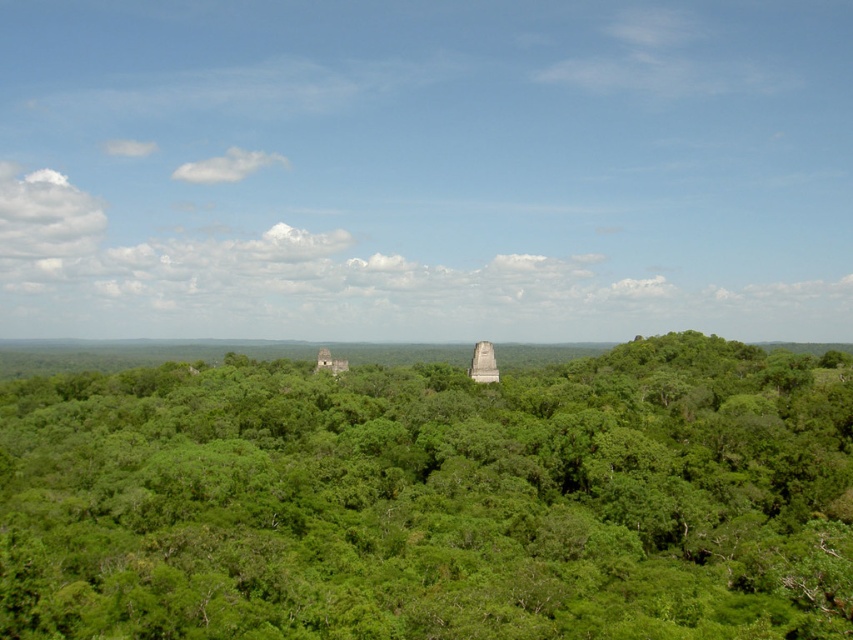
Is green leafy trees at center thinner than smooth gray stone pyramid at center?

No.

Does point (262, 500) come in front of point (477, 371)?

Yes, it is.

Where is `green leafy trees at center`? This screenshot has height=640, width=853. green leafy trees at center is located at coordinates (433, 499).

Does green leafy trees at center have a larger size compared to gray stone pyramid at center?

Indeed, green leafy trees at center has a larger size compared to gray stone pyramid at center.

Does point (363, 577) come closer to viewer compared to point (318, 358)?

Yes, it is.

Is point (816, 566) more distant than point (337, 372)?

That is False.

The width and height of the screenshot is (853, 640). Find the location of `green leafy trees at center`. green leafy trees at center is located at coordinates (433, 499).

Is smooth gray stone pyramid at center below gray stone pyramid at center?

Incorrect, smooth gray stone pyramid at center is not positioned below gray stone pyramid at center.

From the picture: Is smooth gray stone pyramid at center above gray stone pyramid at center?

Correct, smooth gray stone pyramid at center is located above gray stone pyramid at center.

Locate an element on the screen. This screenshot has height=640, width=853. smooth gray stone pyramid at center is located at coordinates (483, 364).

The image size is (853, 640). What are the coordinates of `smooth gray stone pyramid at center` in the screenshot? It's located at pos(483,364).